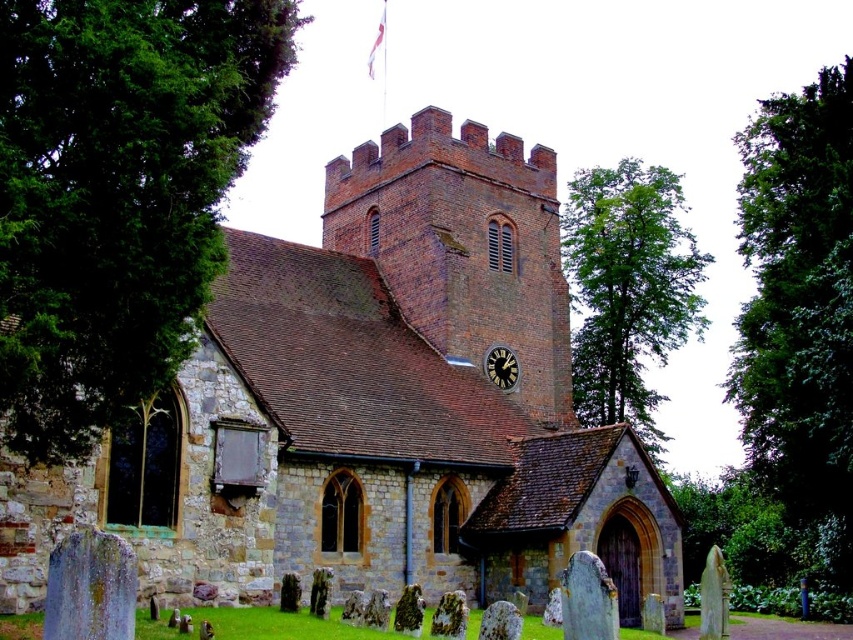
Question: Which is nearer to the green leafy tree at upper center?

Choices:
 (A) green leafy tree at left
 (B) black metal clock at upper center

Answer: (B)

Question: Which is farther from the black metal clock at upper center?

Choices:
 (A) green leafy tree at upper center
 (B) green leafy tree at upper right

Answer: (A)

Question: Is green leafy tree at left above green leafy tree at upper right?

Choices:
 (A) no
 (B) yes

Answer: (A)

Question: Which point is farther to the camera?

Choices:
 (A) brown stone church at center
 (B) black metal clock at upper center
 (C) green leafy tree at upper right
 (D) green leafy tree at left

Answer: (B)

Question: Is brown stone church at center closer to camera compared to black metal clock at upper center?

Choices:
 (A) yes
 (B) no

Answer: (A)

Question: Does green leafy tree at upper right appear under green leafy tree at upper center?

Choices:
 (A) yes
 (B) no

Answer: (B)